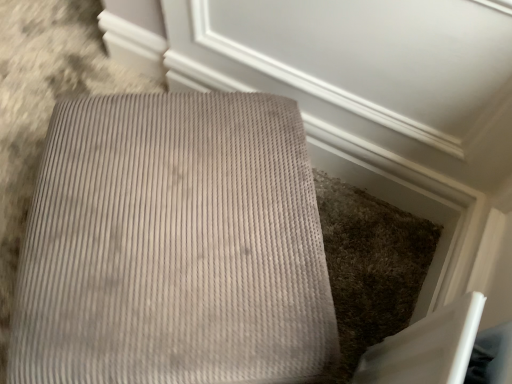
Question: Is beige corduroy ottoman at center not within matte gray carpet at upper center?

Choices:
 (A) no
 (B) yes

Answer: (B)

Question: From a real-world perspective, is beige corduroy ottoman at center beneath matte gray carpet at upper center?

Choices:
 (A) yes
 (B) no

Answer: (A)

Question: Does beige corduroy ottoman at center have a larger size compared to matte gray carpet at upper center?

Choices:
 (A) no
 (B) yes

Answer: (B)

Question: Considering the relative sizes of beige corduroy ottoman at center and matte gray carpet at upper center in the image provided, is beige corduroy ottoman at center smaller than matte gray carpet at upper center?

Choices:
 (A) no
 (B) yes

Answer: (A)

Question: Is beige corduroy ottoman at center surrounding matte gray carpet at upper center?

Choices:
 (A) yes
 (B) no

Answer: (B)

Question: Could you tell me if beige corduroy ottoman at center is turned towards matte gray carpet at upper center?

Choices:
 (A) no
 (B) yes

Answer: (A)

Question: Can you confirm if matte gray carpet at upper center is positioned to the right of beige corduroy ottoman at center?

Choices:
 (A) no
 (B) yes

Answer: (B)

Question: Considering the relative positions of matte gray carpet at upper center and beige corduroy ottoman at center in the image provided, is matte gray carpet at upper center to the left of beige corduroy ottoman at center from the viewer's perspective?

Choices:
 (A) yes
 (B) no

Answer: (B)

Question: From the image's perspective, is matte gray carpet at upper center on top of beige corduroy ottoman at center?

Choices:
 (A) no
 (B) yes

Answer: (B)

Question: Considering the relative positions of matte gray carpet at upper center and beige corduroy ottoman at center in the image provided, is matte gray carpet at upper center in front of beige corduroy ottoman at center?

Choices:
 (A) yes
 (B) no

Answer: (B)

Question: Does matte gray carpet at upper center have a larger size compared to beige corduroy ottoman at center?

Choices:
 (A) no
 (B) yes

Answer: (A)

Question: Can you confirm if matte gray carpet at upper center is thinner than beige corduroy ottoman at center?

Choices:
 (A) no
 (B) yes

Answer: (B)

Question: From the image's perspective, relative to beige corduroy ottoman at center, is matte gray carpet at upper center above or below?

Choices:
 (A) above
 (B) below

Answer: (A)